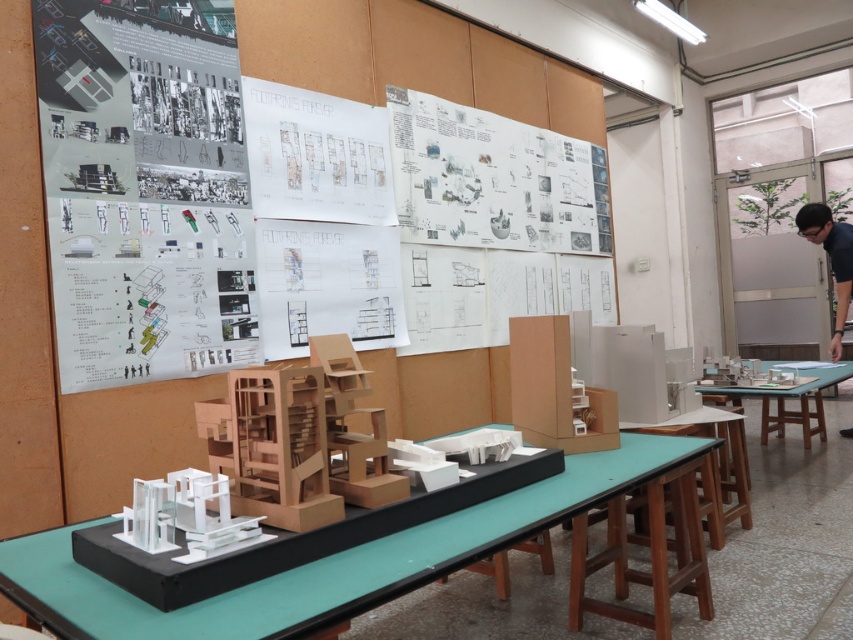
Question: Does white paper at upper center have a smaller size compared to white glossy model at center?

Choices:
 (A) no
 (B) yes

Answer: (A)

Question: Which of the following is the closest to the observer?

Choices:
 (A) black shirt at right
 (B) green matte table at center
 (C) white glossy model at center

Answer: (C)

Question: Observing the image, what is the correct spatial positioning of white paper at upper center in reference to green matte table at center?

Choices:
 (A) left
 (B) right

Answer: (A)

Question: Does white paper at upper center have a larger size compared to green matte table at center?

Choices:
 (A) no
 (B) yes

Answer: (B)

Question: Which point appears farthest from the camera in this image?

Choices:
 (A) (68, 566)
 (B) (846, 433)

Answer: (B)

Question: Among these objects, which one is farthest from the camera?

Choices:
 (A) white paper at upper center
 (B) black shirt at right

Answer: (B)